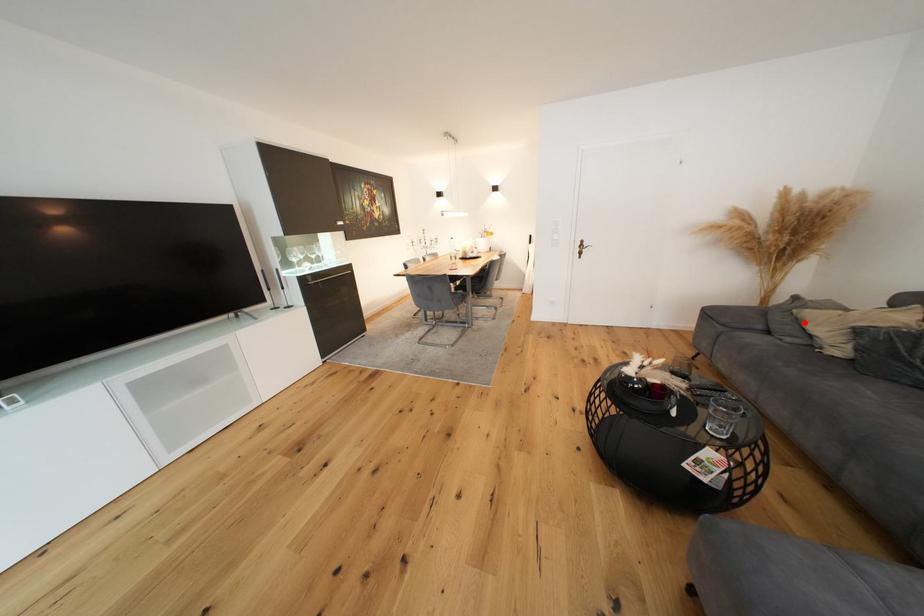
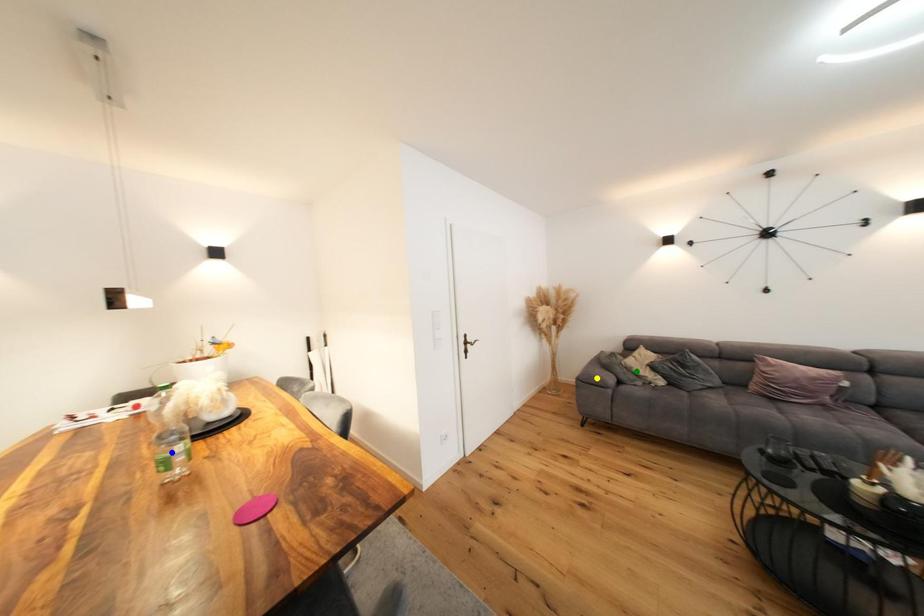
Question: I am providing you with two images of the same scene from different viewpoints. A red point is marked on the first image. You are given multiple points on the second image. In image 2, which mark is for the same physical point as the one in image 1?

Choices:
 (A) blue point
 (B) yellow point
 (C) green point

Answer: (C)